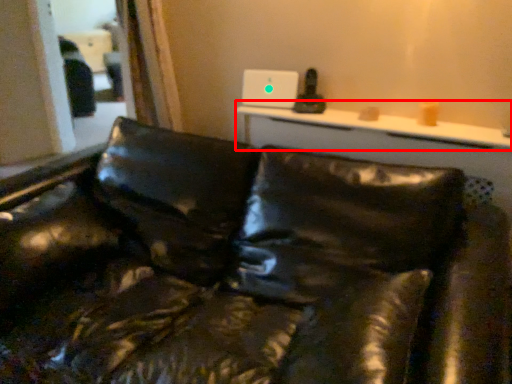
Question: From the image's perspective, what is the correct spatial relationship of table (annotated by the red box) in relation to studio couch?

Choices:
 (A) below
 (B) above

Answer: (B)